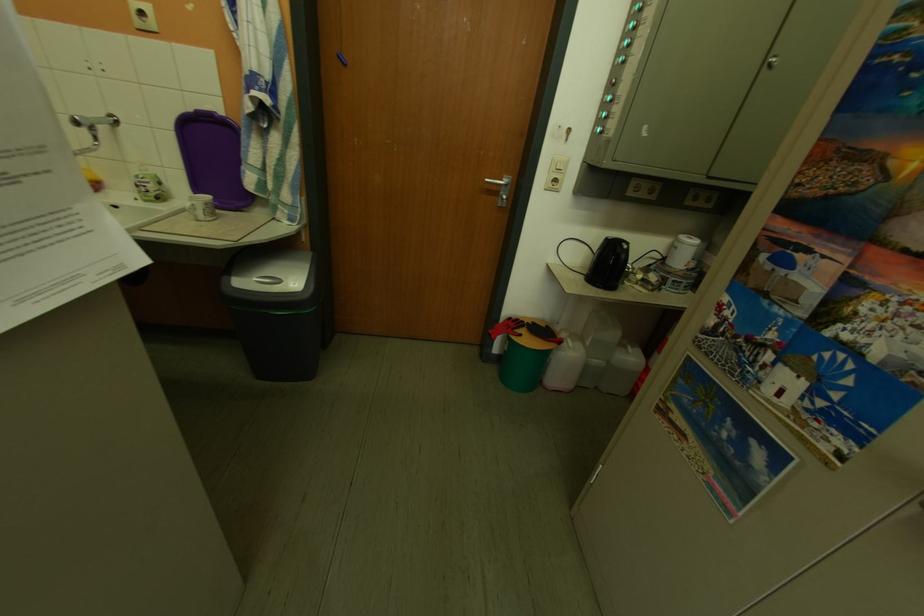
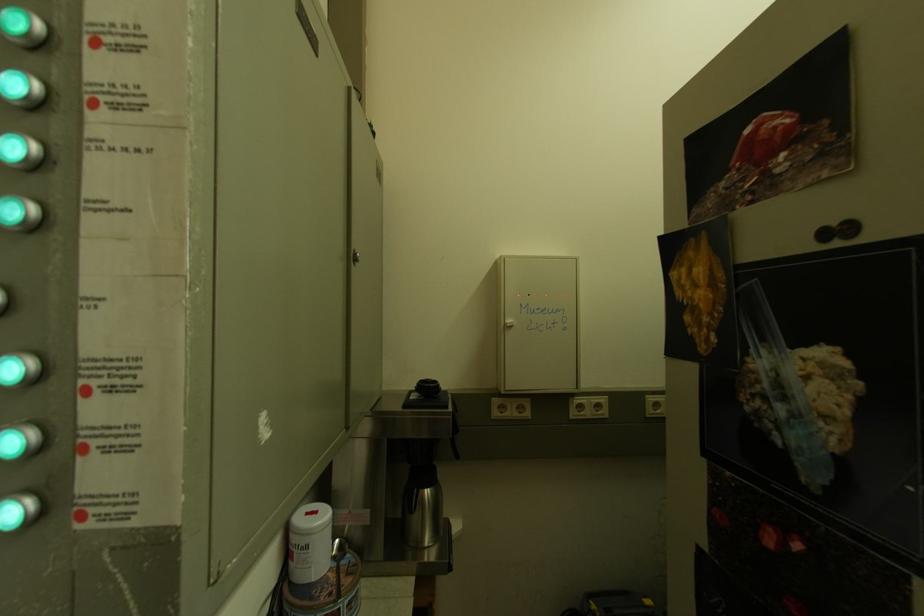
In the second image, find the point that corresponds to (689,251) in the first image.

(320, 551)